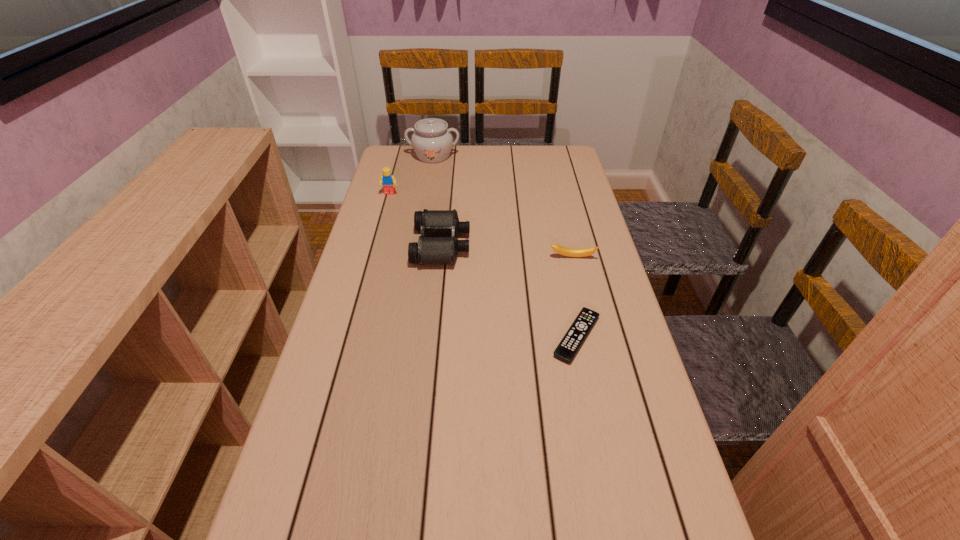
Where is `object that ranks as the fourth closest to the chinaware`? Image resolution: width=960 pixels, height=540 pixels. object that ranks as the fourth closest to the chinaware is located at coordinates (571, 342).

Identify which object is located as the second nearest to the chinaware. Please provide its 2D coordinates. Your answer should be formatted as a tuple, i.e. [(x, y)], where the tuple contains the x and y coordinates of a point satisfying the conditions above.

[(429, 250)]

This screenshot has width=960, height=540. What are the coordinates of `free region that satisfies the following two spatial constraints: 1. on the front-facing side of the second farthest object; 2. on the left side of the nearest object` in the screenshot? It's located at (350, 336).

Locate an element on the screen. free location that satisfies the following two spatial constraints: 1. on the front-facing side of the Lego; 2. on the left side of the nearest object is located at coordinates (350, 336).

This screenshot has height=540, width=960. What are the coordinates of `vacant area that satisfies the following two spatial constraints: 1. through the eyepieces of the nearest object; 2. on the left side of the third shortest object` in the screenshot? It's located at (432, 336).